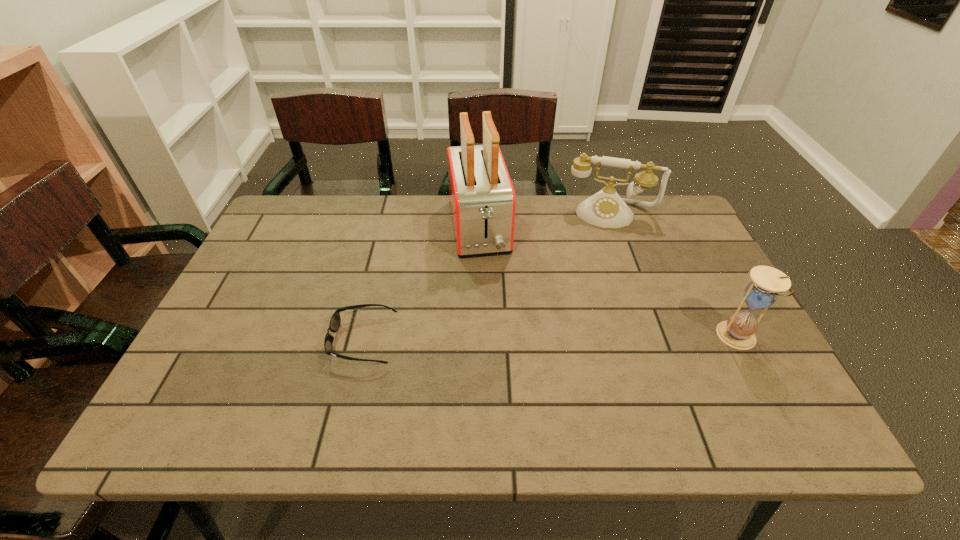
This screenshot has height=540, width=960. In order to click on free space located on the dial of the telephone in this screenshot , I will do `click(596, 294)`.

At what (x,y) coordinates should I click in order to perform the action: click on free location located on the dial of the telephone. Please return your answer as a coordinate pair (x, y). Looking at the image, I should click on (602, 244).

The width and height of the screenshot is (960, 540). What are the coordinates of `vacant space located on the dial of the telephone` in the screenshot? It's located at (600, 262).

Locate an element on the screen. vacant space located on the front-facing side of the second object from left to right is located at coordinates (499, 340).

Identify the location of free space located 0.110m on the front-facing side of the second object from left to right. The image size is (960, 540). (490, 292).

The width and height of the screenshot is (960, 540). Find the location of `vacant position located 0.280m on the front-facing side of the second object from left to right`. vacant position located 0.280m on the front-facing side of the second object from left to right is located at coordinates (500, 344).

Find the location of a particular element. telephone present at the far edge is located at coordinates (606, 209).

The width and height of the screenshot is (960, 540). What are the coordinates of `toaster at the far edge` in the screenshot? It's located at (482, 198).

Identify the location of object at the near edge. Image resolution: width=960 pixels, height=540 pixels. (335, 321).

This screenshot has height=540, width=960. In order to click on hourglass present at the right edge in this screenshot , I will do `click(738, 331)`.